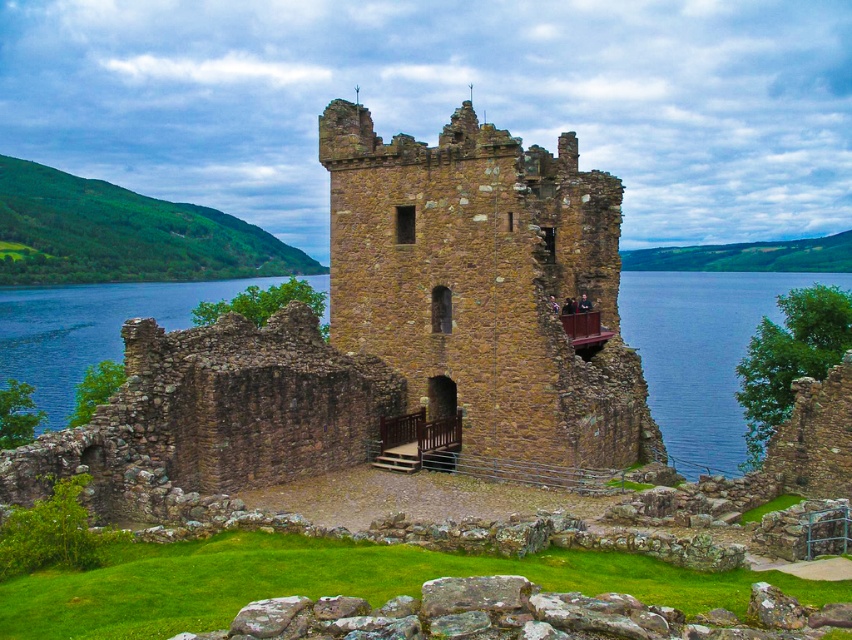
Question: Does brown stone water at center appear over blue water at lower right?

Choices:
 (A) no
 (B) yes

Answer: (A)

Question: Which point is farther from the camera taking this photo?

Choices:
 (A) (692, 420)
 (B) (579, 420)

Answer: (A)

Question: Which of these objects is positioned farthest from the blue water at lower right?

Choices:
 (A) brown stone water at center
 (B) brown stone tower at center

Answer: (B)

Question: Does brown stone tower at center appear on the left side of brown stone water at center?

Choices:
 (A) yes
 (B) no

Answer: (B)

Question: Is brown stone tower at center smaller than brown stone water at center?

Choices:
 (A) yes
 (B) no

Answer: (A)

Question: Which of the following is the farthest from the observer?

Choices:
 (A) (723, 392)
 (B) (694, 474)
 (C) (337, 205)
 (D) (648, 410)

Answer: (A)